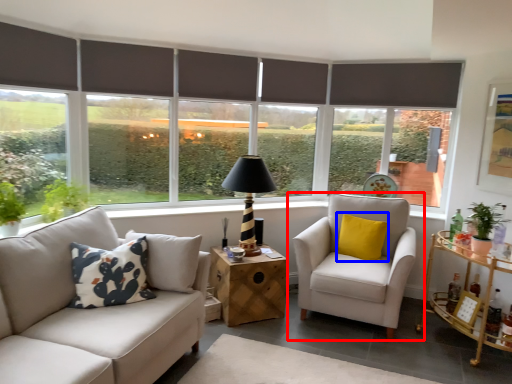
Question: Among these objects, which one is farthest to the camera, chair (highlighted by a red box) or pillow (highlighted by a blue box)?

Choices:
 (A) chair
 (B) pillow

Answer: (B)